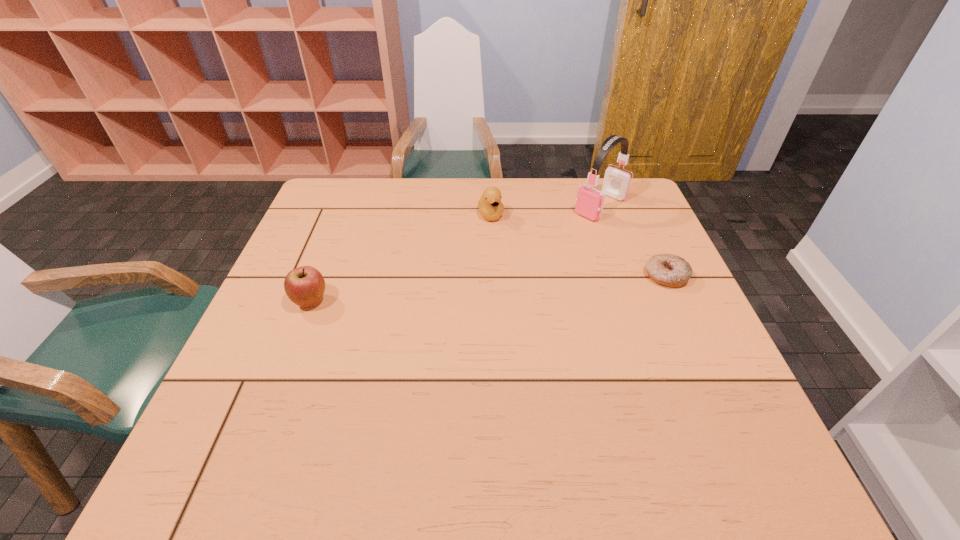
Where is `vacant space at the left edge of the desktop`? The height and width of the screenshot is (540, 960). vacant space at the left edge of the desktop is located at coordinates (344, 234).

Find the location of a particular element. blank space at the right edge is located at coordinates (679, 300).

At what (x,y) coordinates should I click in order to perform the action: click on vacant space at the far left corner of the desktop. Please return your answer as a coordinate pair (x, y). Looking at the image, I should click on (344, 213).

Locate an element on the screen. Image resolution: width=960 pixels, height=540 pixels. free region at the near left corner of the desktop is located at coordinates (221, 395).

This screenshot has height=540, width=960. In the image, there is a desktop. Identify the location of free space at the far right corner. (630, 190).

Locate an element on the screen. Image resolution: width=960 pixels, height=540 pixels. free space between the leftmost object and the shortest object is located at coordinates (489, 289).

Identify the location of empty space between the shortest object and the tallest object. The height and width of the screenshot is (540, 960). (634, 241).

The image size is (960, 540). Identify the location of vacant region between the apple and the doughnut. (489, 289).

This screenshot has height=540, width=960. In order to click on free area in between the tallest object and the third object from right to left in this screenshot , I will do `click(545, 211)`.

Identify the location of empty space that is in between the leftmost object and the shortest object. Image resolution: width=960 pixels, height=540 pixels. (489, 289).